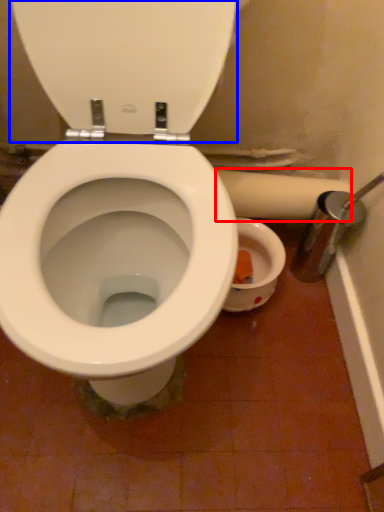
Question: Which point is further to the camera, toilet paper (highlighted by a red box) or back (highlighted by a blue box)?

Choices:
 (A) toilet paper
 (B) back

Answer: (A)